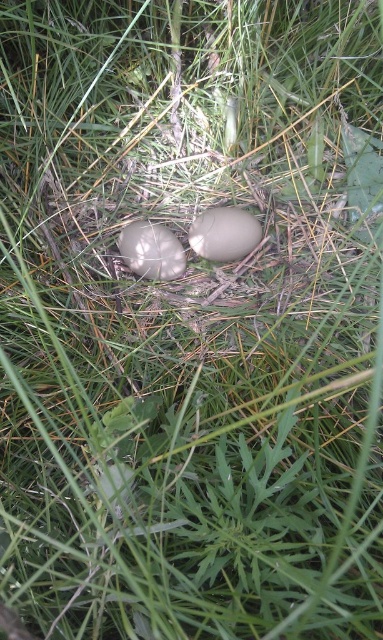
You are a wildlife researcher observing the scene. You need to locate the smooth brown egg at center. According to the coordinates provided, where exactly is the smooth brown egg positioned in the image?

The smooth brown egg at center is located at coordinates point (224, 234).

Based on the photo, you are an animal trying to hide from predators. You have to choose between the smooth brown egg at center and the smooth beige egg at center to blend in with the grassy surroundings. Which egg would be better for camouflage based on their sizes?

The smooth brown egg at center occupies less space than the smooth beige egg at center, so it might be better for camouflage as it is smaller and less noticeable among the grass blades.

You are a researcher studying egg placement in natural habitats. You observe two eggs in the image. One is the smooth brown egg at center located at point (224, 234). Where is the other egg in relation to this point?

The other egg is positioned close to the smooth brown egg at center located at point (224, 234).